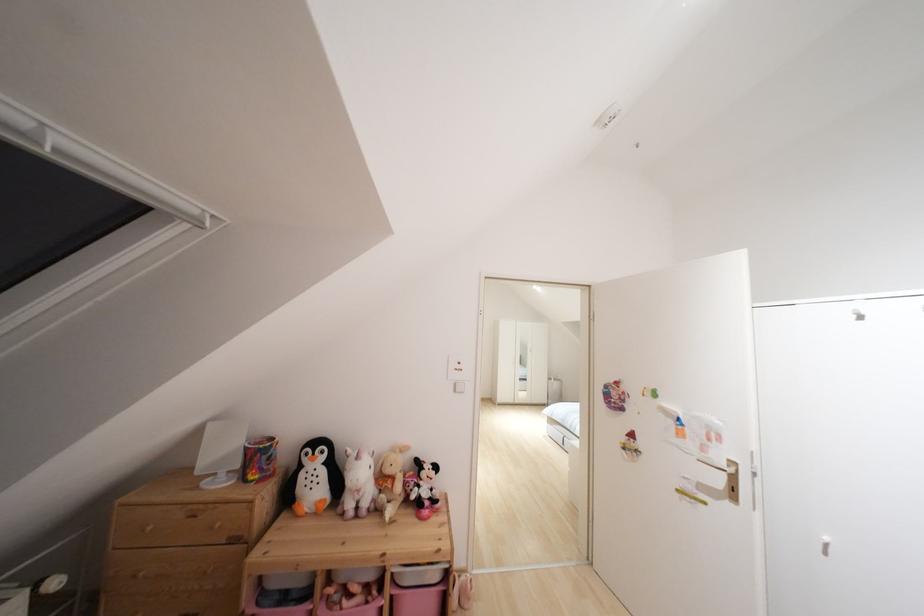
Locate an element on the screen. Image resolution: width=924 pixels, height=616 pixels. white cabinet handle is located at coordinates (824, 545).